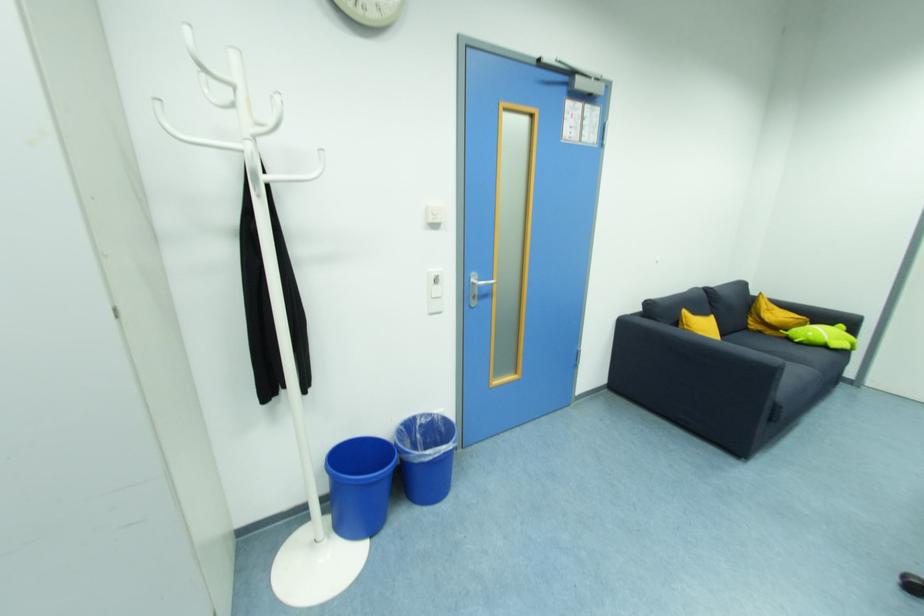
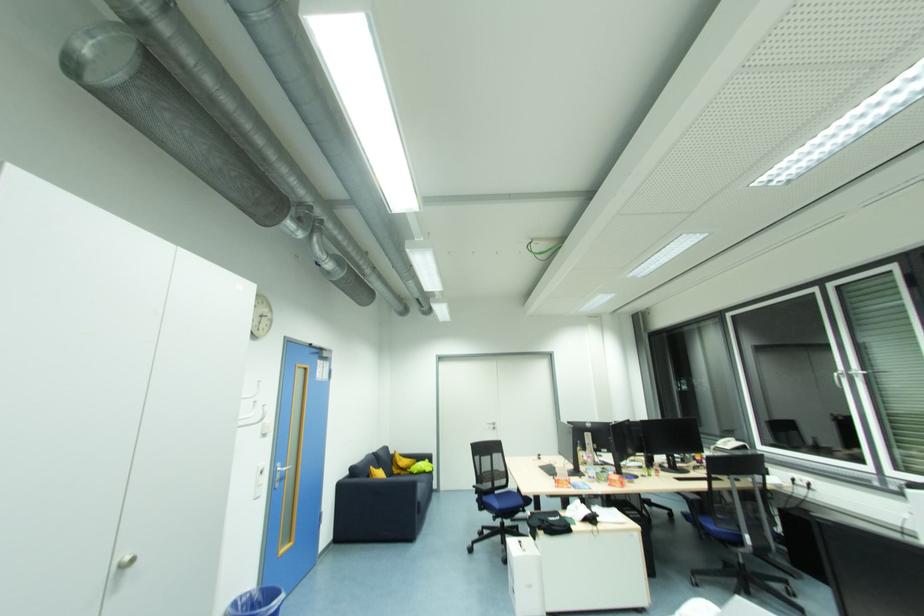
In the second image, find the point that corresponds to pixel 757 328 in the first image.

(398, 472)